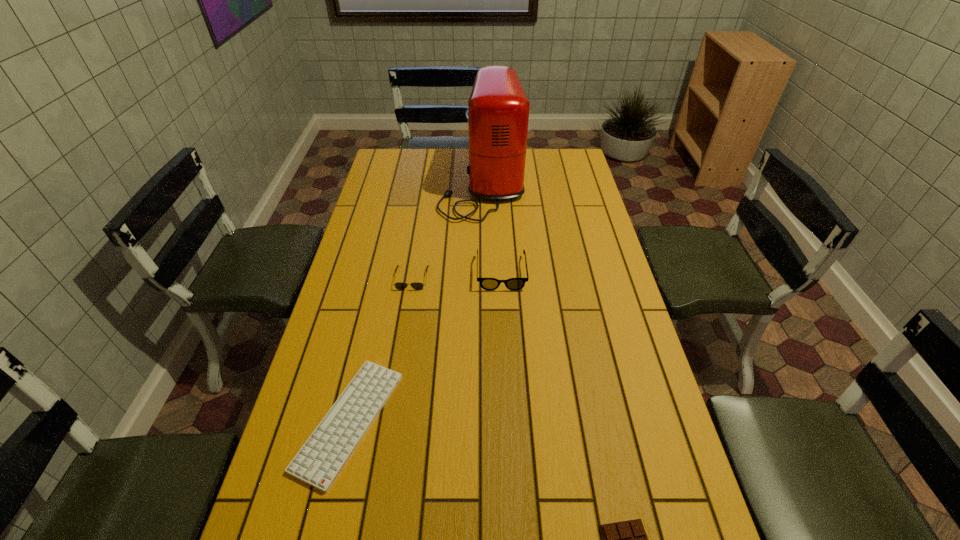
You are a GUI agent. You are given a task and a screenshot of the screen. Output one action in this format:
    pyautogui.click(x=<x>, y=<y>)
    Task: Click on the free space between the third shortest object and the computer keyboard
    
    Given the screenshot: What is the action you would take?
    pyautogui.click(x=380, y=349)

I want to click on object that can be found as the second closest to the computer keyboard, so click(489, 284).

Where is `object that ranks as the second closest to the nearest object`? The height and width of the screenshot is (540, 960). object that ranks as the second closest to the nearest object is located at coordinates (489, 284).

This screenshot has width=960, height=540. I want to click on free space in the image that satisfies the following two spatial constraints: 1. on the front-facing side of the kitchen mixer; 2. on the front-facing side of the third shortest object, so click(484, 278).

Identify the location of blank space that satisfies the following two spatial constraints: 1. on the front-facing side of the farthest object; 2. on the front-facing side of the third shortest object. The image size is (960, 540). (484, 278).